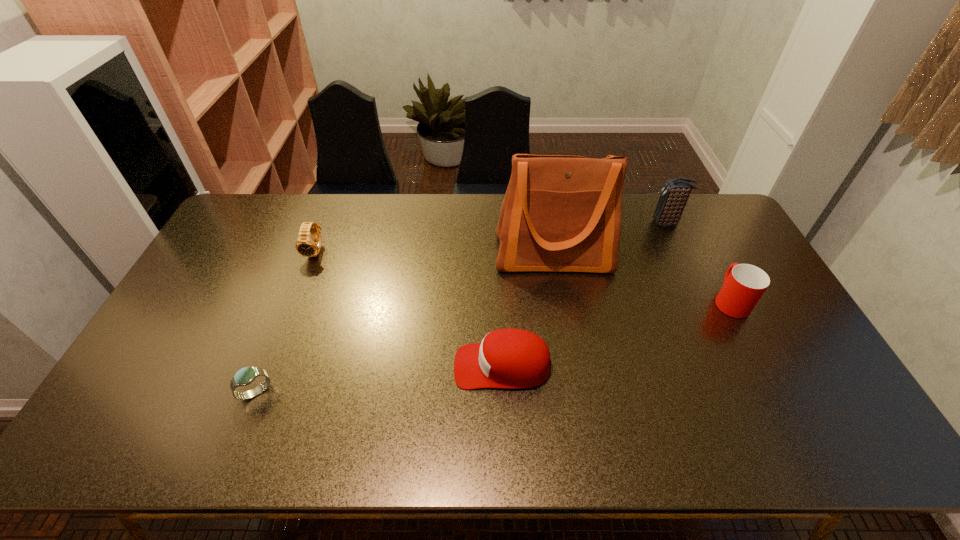
This screenshot has height=540, width=960. In order to click on free space in the image that satisfies the following two spatial constraints: 1. on the back side of the shortest object; 2. on the left side of the shopping bag in this screenshot , I will do `click(310, 255)`.

Identify the location of blank area in the image that satisfies the following two spatial constraints: 1. with the zip open on the clutch bag; 2. on the face of the taller watch. The image size is (960, 540). (680, 251).

Where is `free space that satisfies the following two spatial constraints: 1. on the face of the farther watch; 2. on the right side of the tallest object`? The height and width of the screenshot is (540, 960). free space that satisfies the following two spatial constraints: 1. on the face of the farther watch; 2. on the right side of the tallest object is located at coordinates (315, 255).